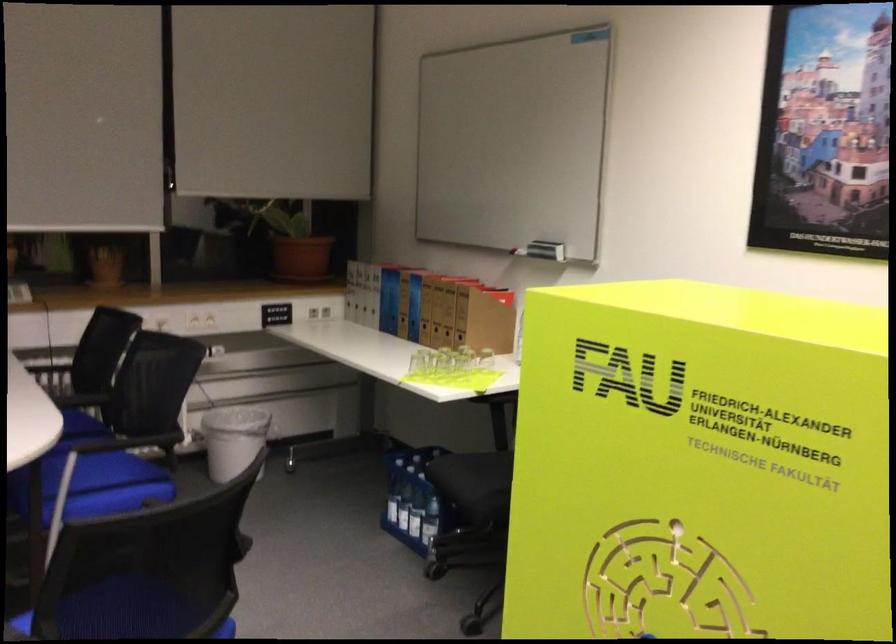
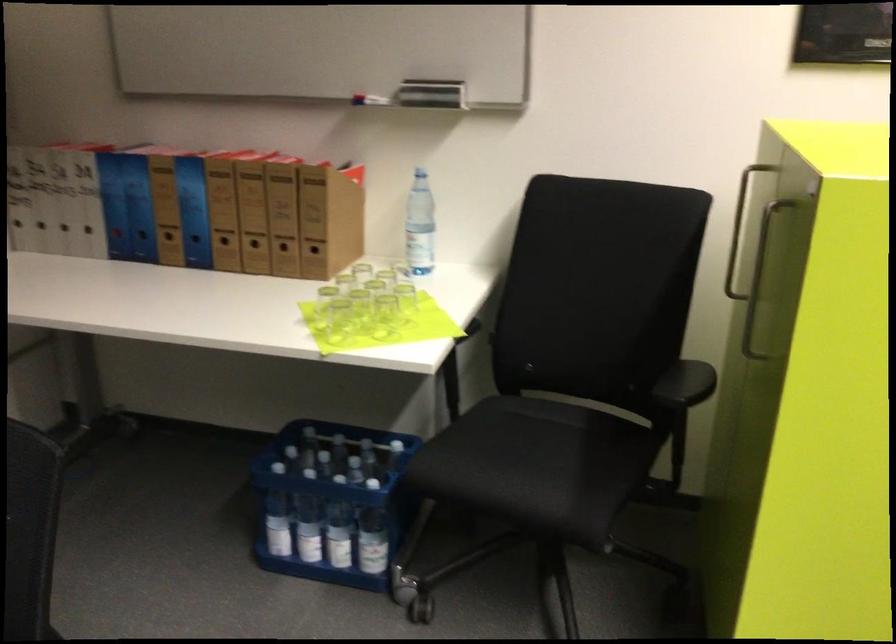
Locate, in the second image, the point that corresponds to [448,335] in the first image.

(283, 252)